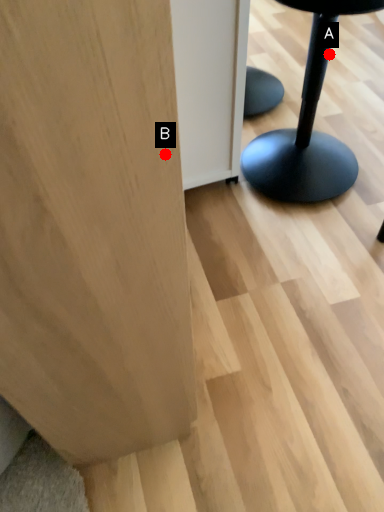
Question: Two points are circled on the image, labeled by A and B beside each circle. Among these points, which one is nearest to the camera?

Choices:
 (A) A is closer
 (B) B is closer

Answer: (B)